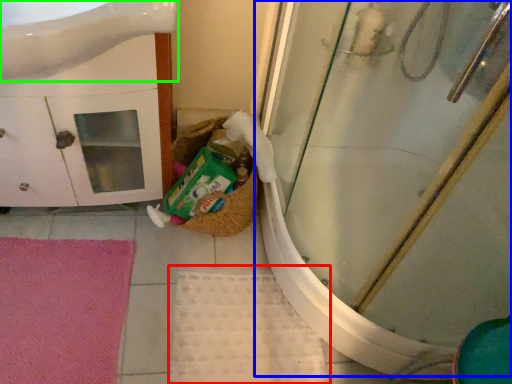
Question: Which is farther away from bath mat (highlighted by a red box)? shower door (highlighted by a blue box) or sink (highlighted by a green box)?

Choices:
 (A) shower door
 (B) sink

Answer: (B)